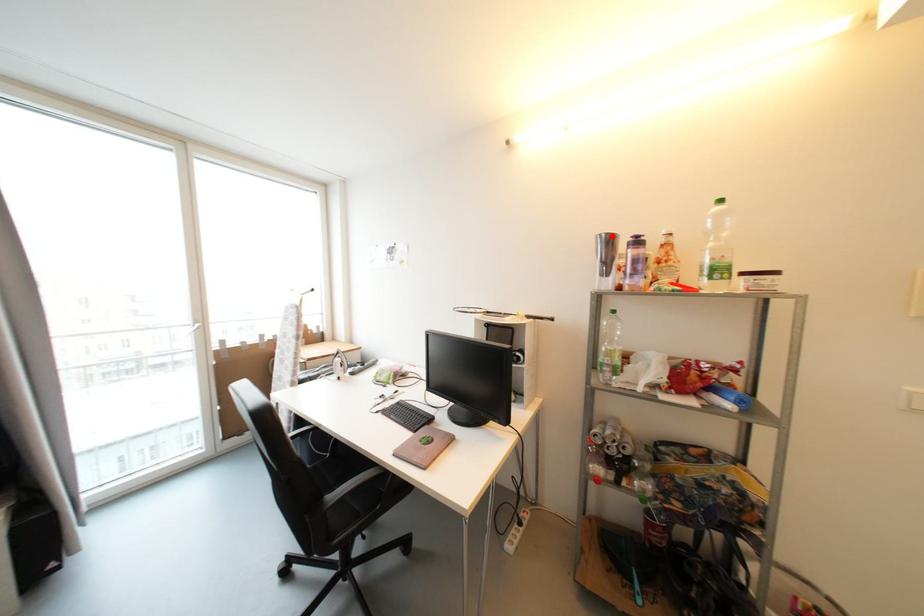
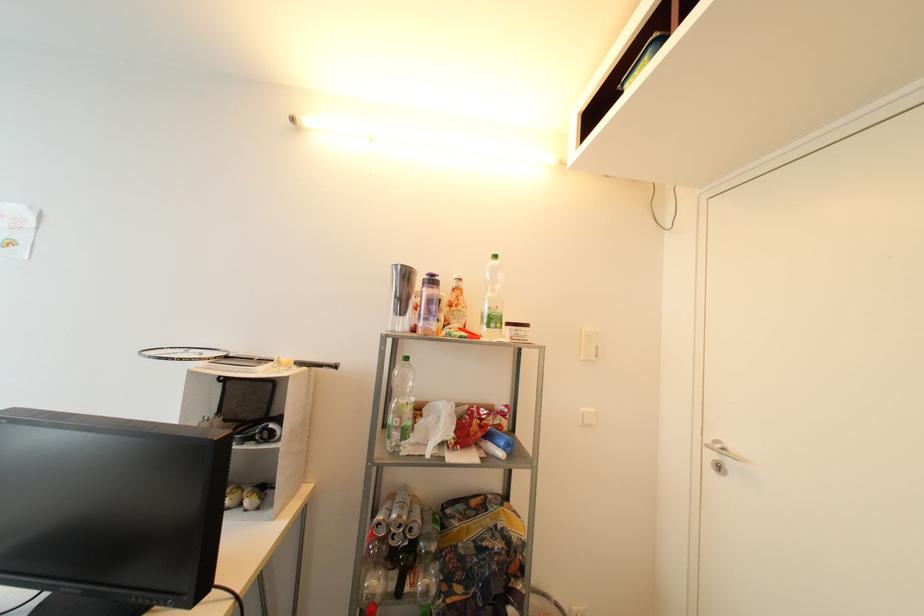
Find the pixel in the second image that matches the highlighted location in the first image.

(407, 268)